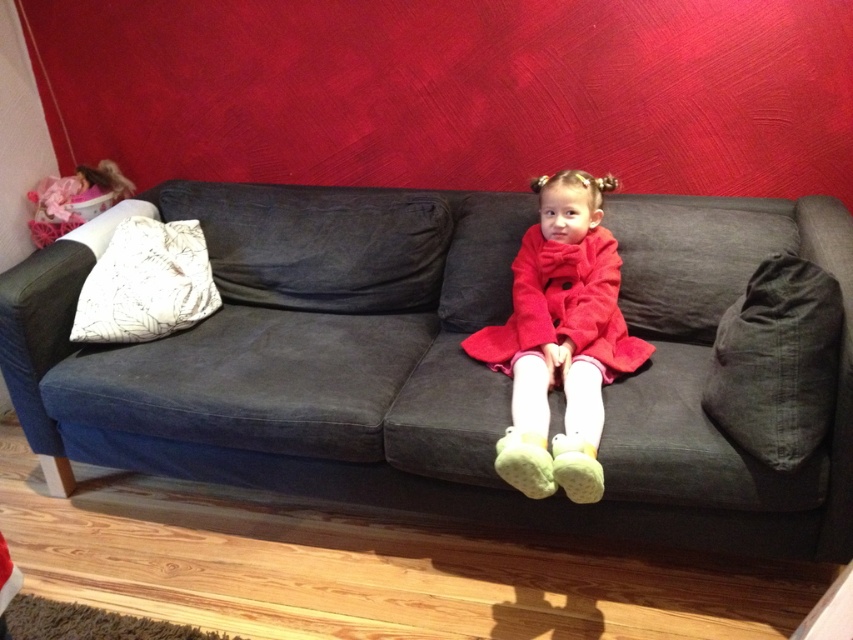
Question: In this image, where is dark gray fabric couch at center located relative to white textured pillow at left?

Choices:
 (A) below
 (B) above

Answer: (A)

Question: Does velvet red coat at center have a smaller size compared to white textured pillow at left?

Choices:
 (A) no
 (B) yes

Answer: (A)

Question: Which point is farther from the camera taking this photo?

Choices:
 (A) (572, 212)
 (B) (132, 292)
 (C) (817, 432)
 (D) (125, 192)

Answer: (D)

Question: Which object is the farthest from the dark gray fabric couch at center?

Choices:
 (A) matte pink doll at upper left
 (B) dark gray fabric pillow at right

Answer: (A)

Question: Can you confirm if velvet red coat at center is positioned below matte pink doll at upper left?

Choices:
 (A) no
 (B) yes

Answer: (B)

Question: Based on their relative distances, which object is farther from the matte pink doll at upper left?

Choices:
 (A) velvet red coat at center
 (B) white textured pillow at left
 (C) dark gray fabric pillow at right

Answer: (C)